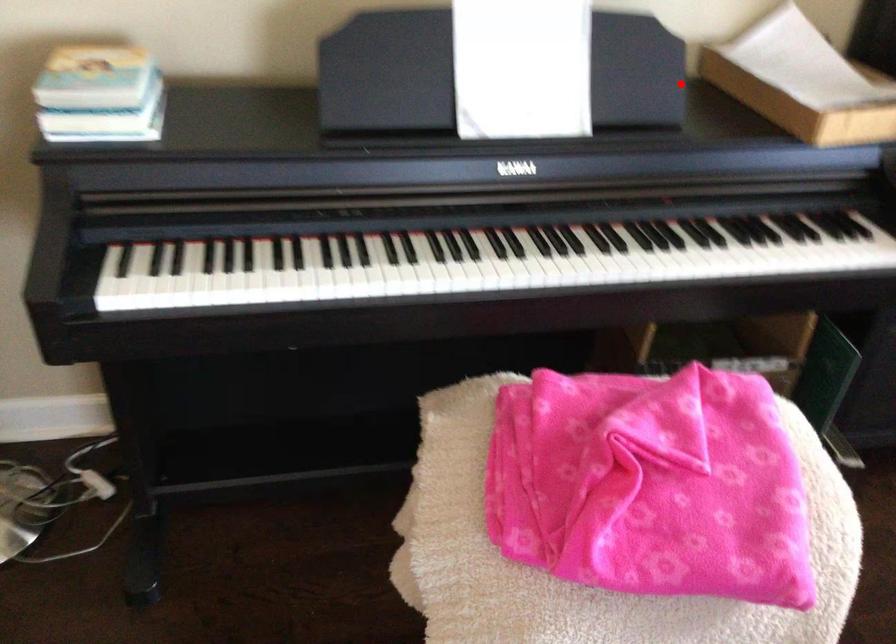
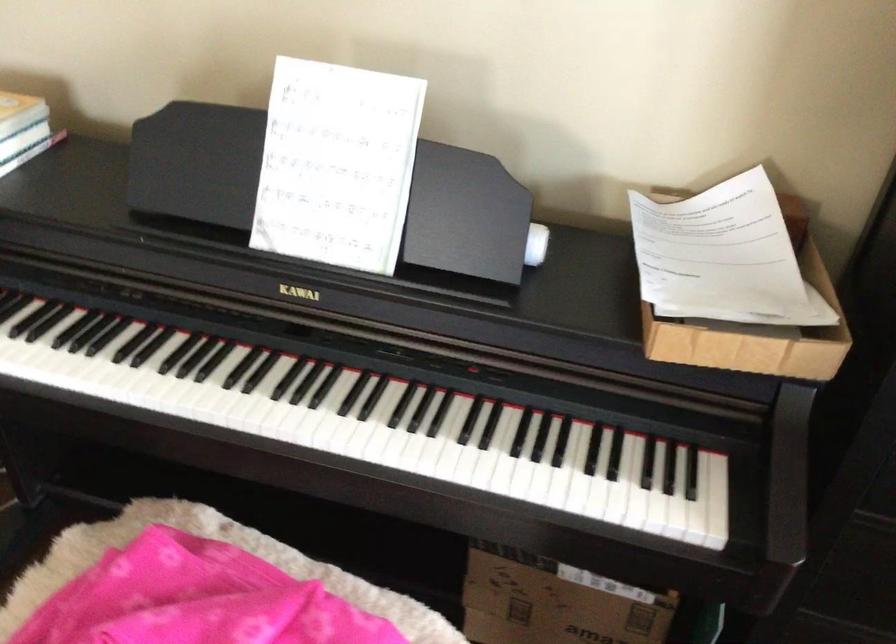
Question: I am providing you with two images of the same scene from different viewpoints. In image1, a red point is highlighted. Considering the same 3D point in image2, which of the following is correct?

Choices:
 (A) It is closer
 (B) It is farther

Answer: (A)